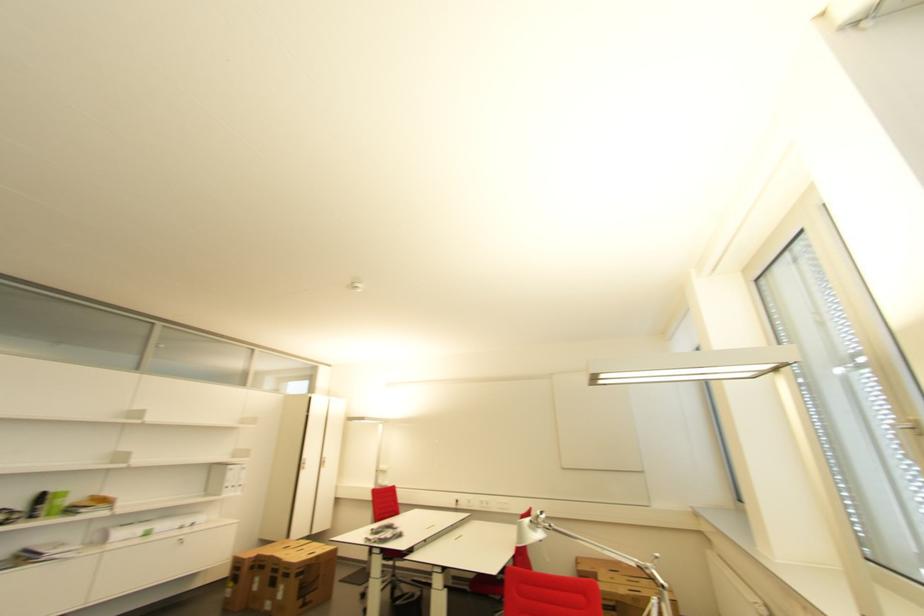
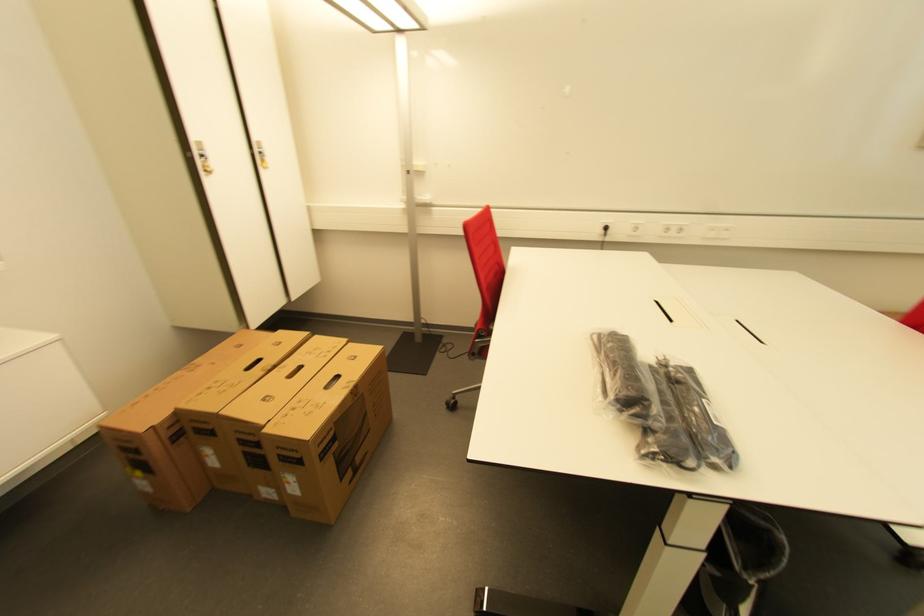
The point at (463, 501) is marked in the first image. Where is the corresponding point in the second image?

(611, 230)